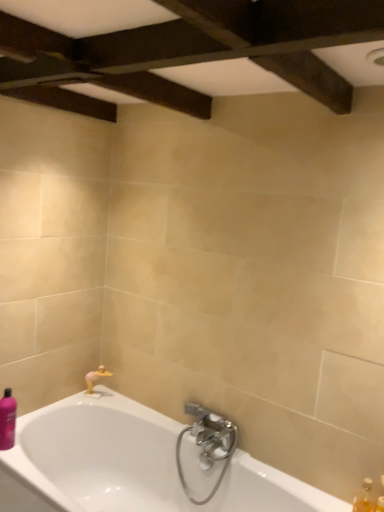
Question: Considering the relative sizes of white glossy bathtub at lower left and translucent plastic soap at lower right, the 2th toiletry in the left-to-right sequence, in the image provided, is white glossy bathtub at lower left thinner than translucent plastic soap at lower right, the 2th toiletry in the left-to-right sequence,?

Choices:
 (A) no
 (B) yes

Answer: (A)

Question: Considering the relative sizes of white glossy bathtub at lower left and translucent plastic soap at lower right, the first toiletry ordered from the bottom, in the image provided, is white glossy bathtub at lower left taller than translucent plastic soap at lower right, the first toiletry ordered from the bottom,?

Choices:
 (A) yes
 (B) no

Answer: (A)

Question: Is white glossy bathtub at lower left shorter than translucent plastic soap at lower right, the first toiletry ordered from the bottom?

Choices:
 (A) yes
 (B) no

Answer: (B)

Question: From the image's perspective, is white glossy bathtub at lower left on translucent plastic soap at lower right, arranged as the first toiletry when viewed from the right?

Choices:
 (A) no
 (B) yes

Answer: (A)

Question: Considering the relative sizes of white glossy bathtub at lower left and translucent plastic soap at lower right, the first toiletry ordered from the bottom, in the image provided, is white glossy bathtub at lower left wider than translucent plastic soap at lower right, the first toiletry ordered from the bottom,?

Choices:
 (A) no
 (B) yes

Answer: (B)

Question: Is translucent plastic soap at lower right, the second toiletry when ordered from top to bottom, wider or thinner than translucent amber bottle at lower right?

Choices:
 (A) wide
 (B) thin

Answer: (A)

Question: From a real-world perspective, is translucent plastic soap at lower right, arranged as the first toiletry when viewed from the right, positioned above or below translucent amber bottle at lower right?

Choices:
 (A) above
 (B) below

Answer: (A)

Question: Considering the positions of translucent plastic soap at lower right, the first toiletry ordered from the bottom, and translucent amber bottle at lower right in the image, is translucent plastic soap at lower right, the first toiletry ordered from the bottom, taller or shorter than translucent amber bottle at lower right?

Choices:
 (A) short
 (B) tall

Answer: (B)

Question: Is translucent plastic soap at lower right, the second toiletry when ordered from top to bottom, inside or outside of translucent amber bottle at lower right?

Choices:
 (A) inside
 (B) outside

Answer: (B)

Question: From their relative heights in the image, would you say translucent amber bottle at lower right is taller or shorter than white glossy bathtub at lower left?

Choices:
 (A) tall
 (B) short

Answer: (B)

Question: From the image's perspective, is translucent amber bottle at lower right above or below white glossy bathtub at lower left?

Choices:
 (A) above
 (B) below

Answer: (A)

Question: In terms of size, does translucent amber bottle at lower right appear bigger or smaller than white glossy bathtub at lower left?

Choices:
 (A) small
 (B) big

Answer: (A)

Question: Looking at their shapes, would you say translucent amber bottle at lower right is wider or thinner than white glossy bathtub at lower left?

Choices:
 (A) wide
 (B) thin

Answer: (B)

Question: From the image's perspective, relative to purple glossy bottle at lower left, acting as the 2th toiletry starting from the bottom, is translucent amber bottle at lower right above or below?

Choices:
 (A) below
 (B) above

Answer: (A)

Question: Relative to purple glossy bottle at lower left, the 1th toiletry in the back-to-front sequence, is translucent amber bottle at lower right in front or behind?

Choices:
 (A) front
 (B) behind

Answer: (A)